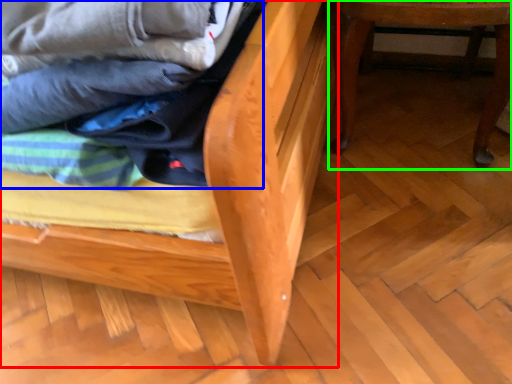
Question: Considering the real-world distances, which object is closest to furniture (highlighted by a red box)? laundry (highlighted by a blue box) or furniture (highlighted by a green box).

Choices:
 (A) laundry
 (B) furniture

Answer: (A)